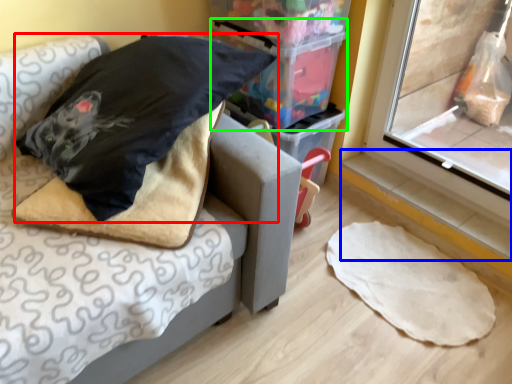
Question: Which is farther away from pillow (highlighted by a red box)? window sill (highlighted by a blue box) or storage box (highlighted by a green box)?

Choices:
 (A) window sill
 (B) storage box

Answer: (A)